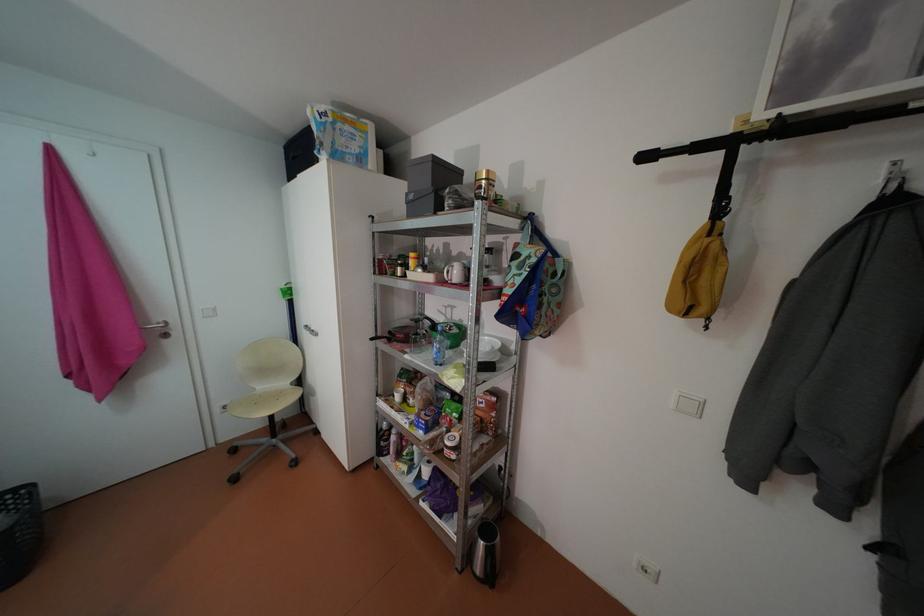
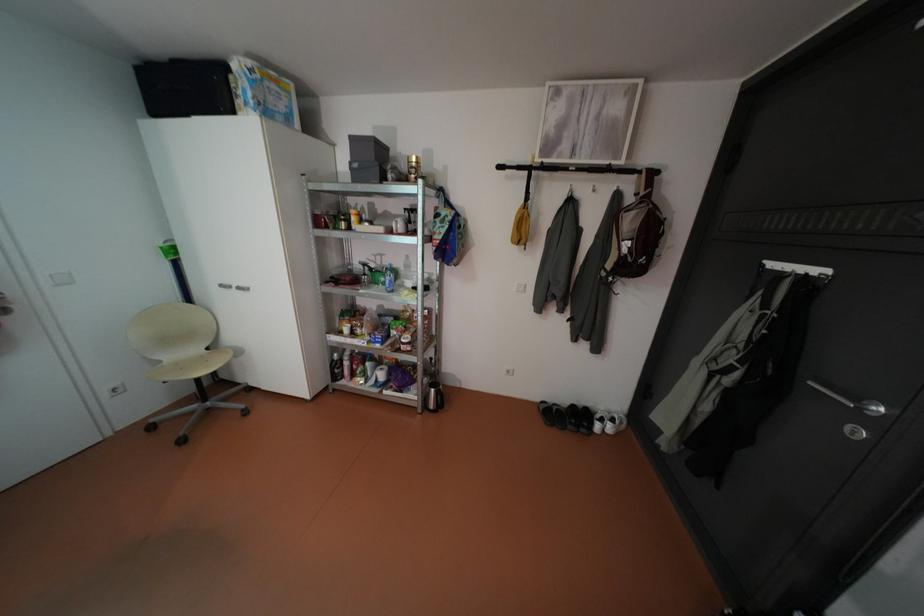
Where in the second image is the point corresponding to point (653, 156) from the first image?

(508, 166)